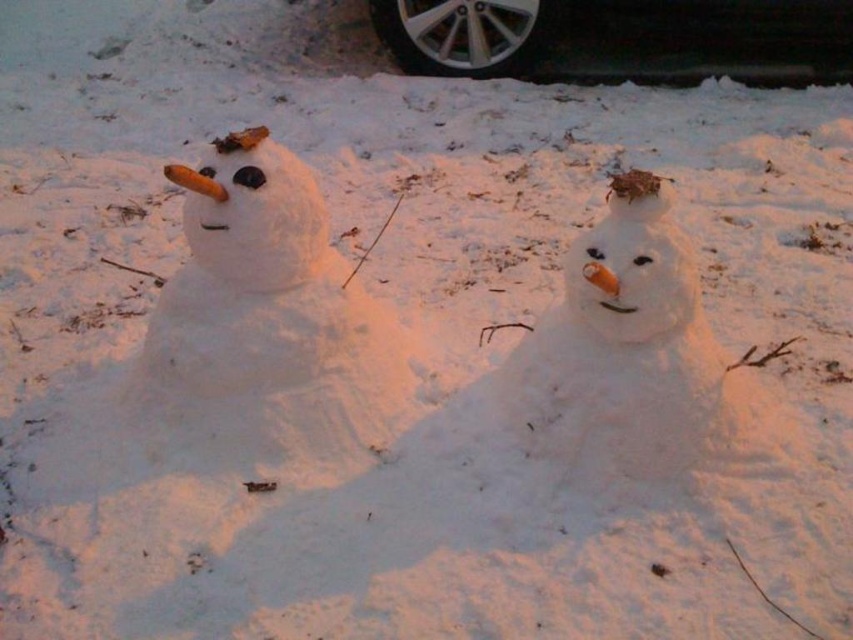
Question: Does white fluffy snowman at center appear on the left side of black rubber tire at upper center?

Choices:
 (A) yes
 (B) no

Answer: (A)

Question: Does white fluffy snowman at left have a lesser width compared to black rubber tire at upper center?

Choices:
 (A) no
 (B) yes

Answer: (B)

Question: Is the position of white fluffy snowman at center more distant than that of black rubber tire at upper center?

Choices:
 (A) yes
 (B) no

Answer: (B)

Question: Which point appears farthest from the camera in this image?

Choices:
 (A) (695, 1)
 (B) (271, 362)

Answer: (A)

Question: Estimate the real-world distances between objects in this image. Which object is farther from the black rubber tire at upper center?

Choices:
 (A) white fluffy snowman at left
 (B) white fluffy snowman at center

Answer: (B)

Question: Among these points, which one is farthest from the camera?

Choices:
 (A) (289, 380)
 (B) (634, 54)

Answer: (B)